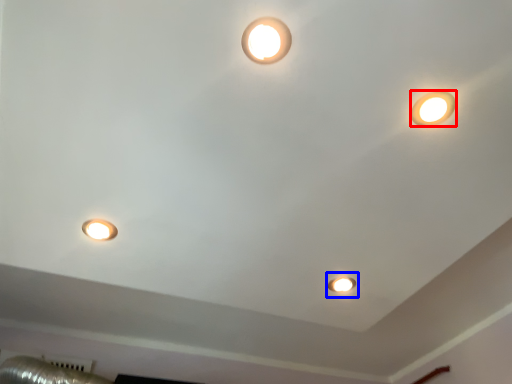
Question: Which object appears farthest to the camera in this image, lamp (highlighted by a red box) or stage light (highlighted by a blue box)?

Choices:
 (A) lamp
 (B) stage light

Answer: (B)